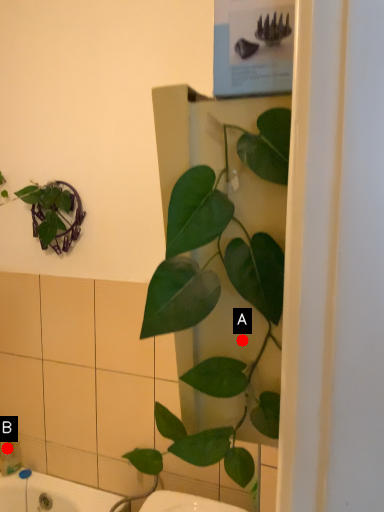
Question: Two points are circled on the image, labeled by A and B beside each circle. Which point is closer to the camera?

Choices:
 (A) A is closer
 (B) B is closer

Answer: (A)